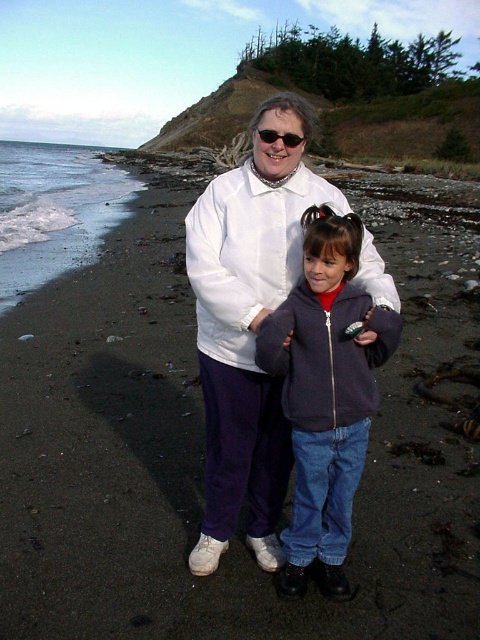
You are a photographer trying to capture a closeup shot of the dark gray fleece jacket at center and the matte black sunglasses at center. Since you want both objects to appear the same size in the photo, which object should you move closer to the camera and which should you move farther away?

The dark gray fleece jacket at center is bigger than the matte black sunglasses at center. To make them appear the same size in the photo, move the dark gray fleece jacket at center farther away from the camera and bring the matte black sunglasses at center closer. This way, the larger jacket will appear smaller when distant, and the smaller sunglasses will look bigger when near.

You are a photographer standing at the center of the beach scene. You want to take a photo of both the dark gray fleece jacket at center and the matte black sunglasses at center. Since you have a camera with a 50mm lens, which has a maximum focusing distance of 3 feet, will you be able to capture both objects clearly in focus?

The dark gray fleece jacket at center is 3.36 feet away from matte black sunglasses at center. Since the camera can only focus up to 3 feet, the distance between them exceeds the maximum focusing distance. Therefore, you won